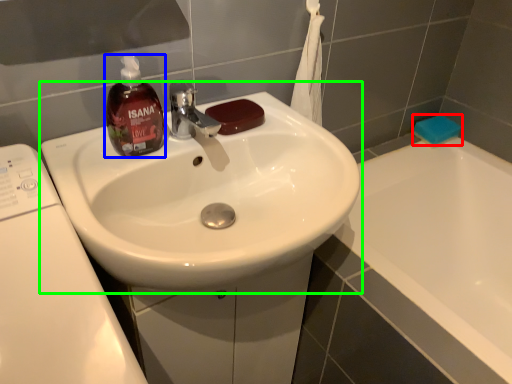
Question: Estimate the real-world distances between objects in this image. Which object is closer to soap (highlighted by a red box), bottle (highlighted by a blue box) or sink (highlighted by a green box)?

Choices:
 (A) bottle
 (B) sink

Answer: (B)